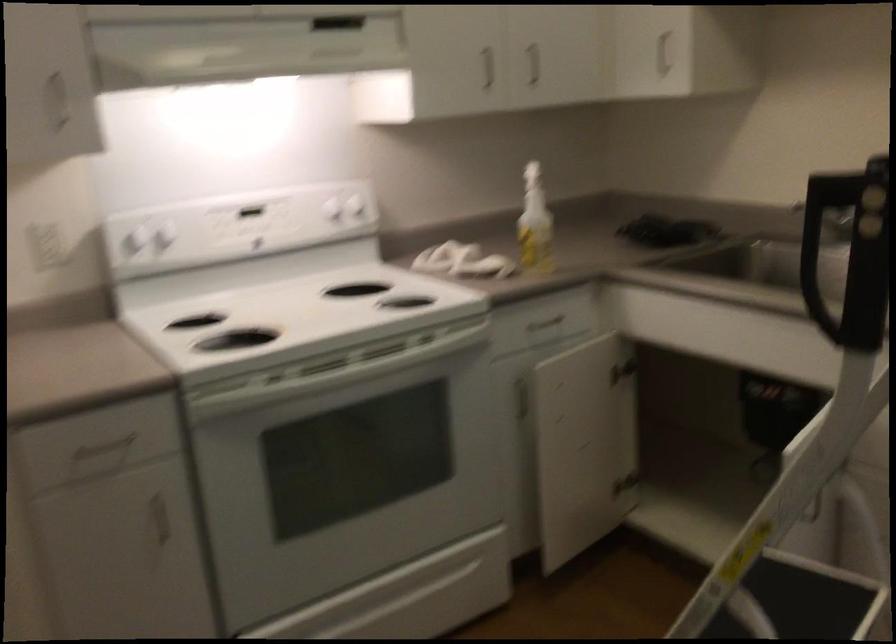
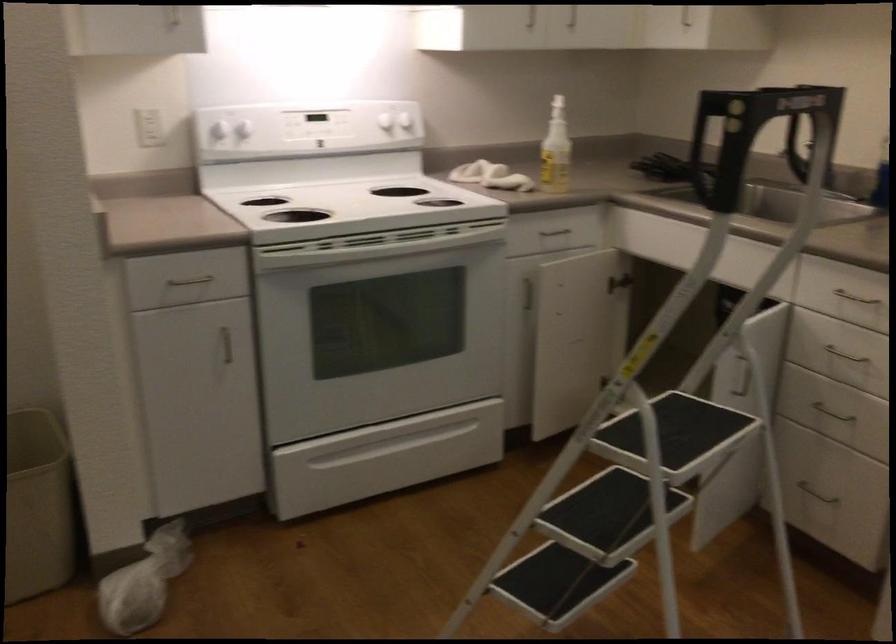
Where in the second image is the point corresponding to (169,242) from the first image?

(245, 128)